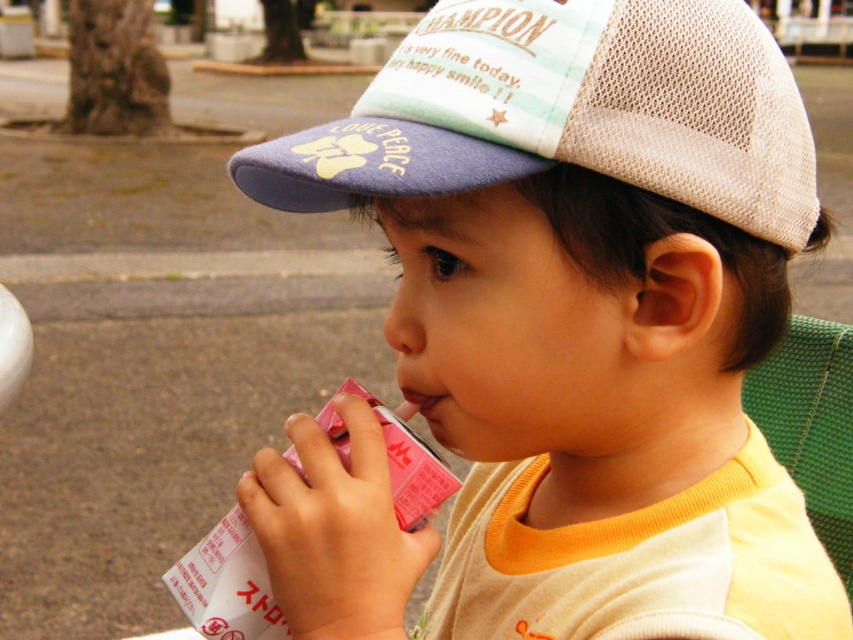
You are a photographer taking a picture of the child. The matte plastic cup at center and the pastel striped mesh cap at upper center are both in the frame. Which object is positioned lower in the image?

The matte plastic cup at center is positioned lower than the pastel striped mesh cap at upper center.

You are a photographer trying to capture a closeup of the matte plastic cup at center and the pastel striped mesh cap at upper center in the image. Your camera can only focus on objects within a 10 cm range. Can you get both in focus at the same time?

The matte plastic cup at center and the pastel striped mesh cap at upper center are 10.47 centimeters apart. Since the distance between them exceeds the camera focus range of 10 cm, you cannot get both in focus simultaneously.